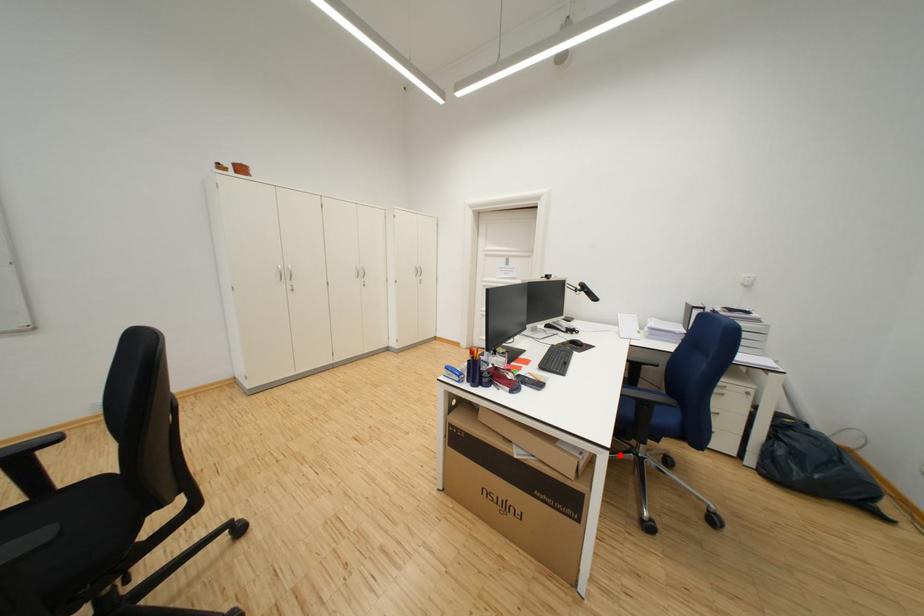
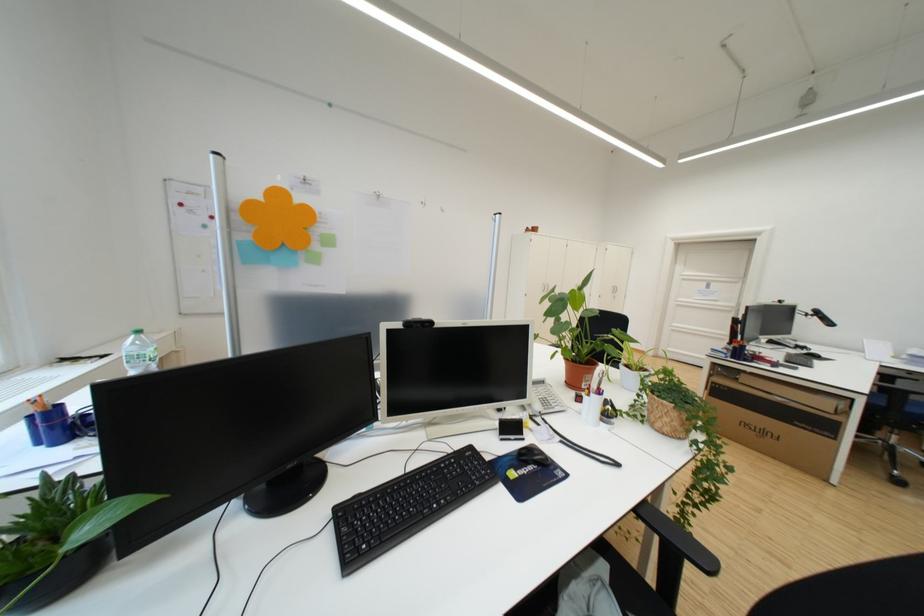
Where in the second image is the point corresponding to the highlighted location from the first image?

(878, 400)